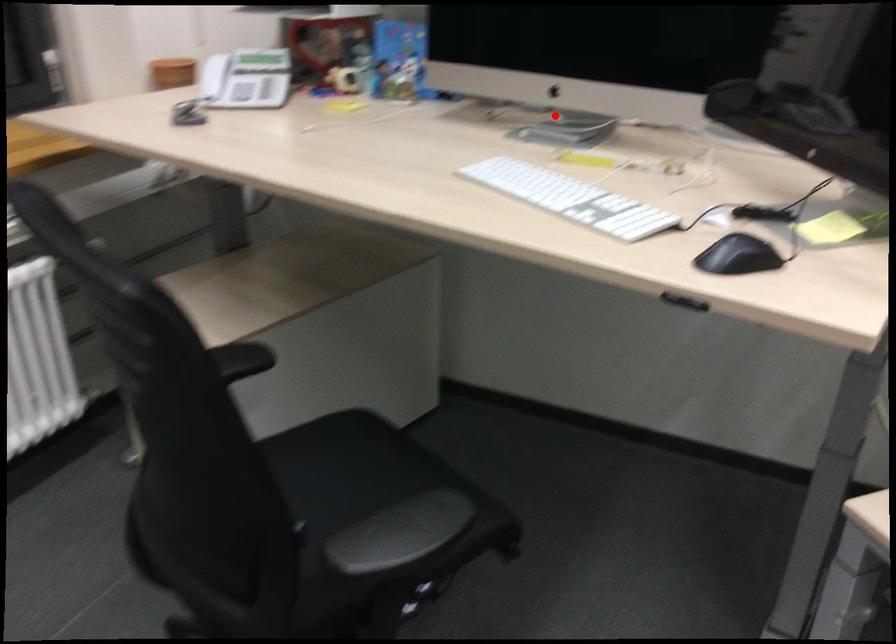
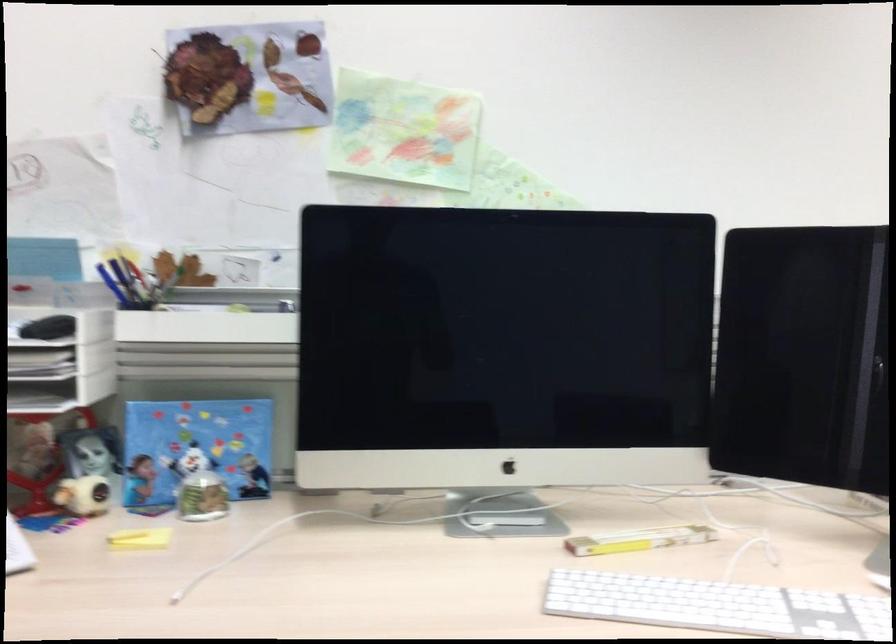
In the second image, find the point that corresponds to the highlighted location in the first image.

(449, 494)